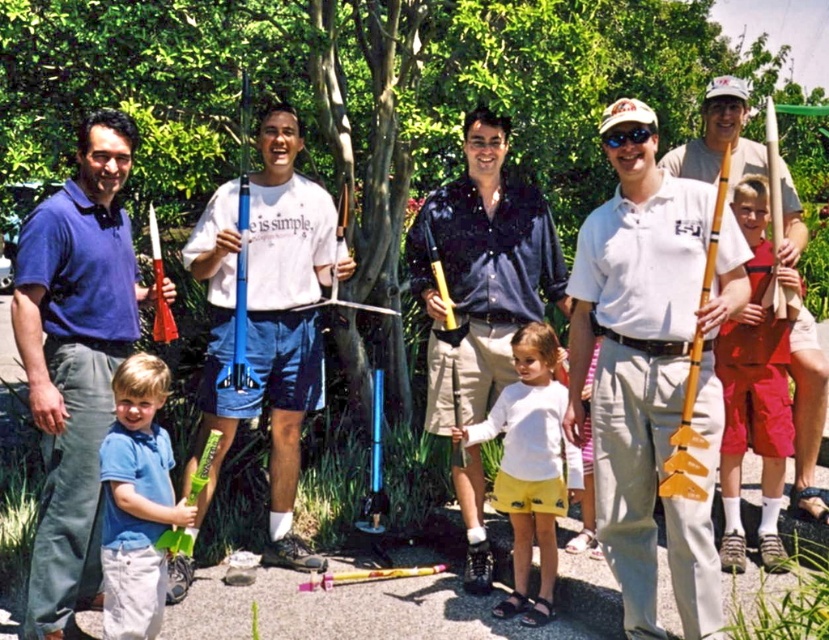
You are standing in the garden where the group is posing for a photo. You want to take a closer look at the two points marked in the image. Which point, point (x=284, y=330) or point (x=779, y=566), is closer to you?

Point (x=284, y=330) is closer to you because it is further to the viewer than point (x=779, y=566).